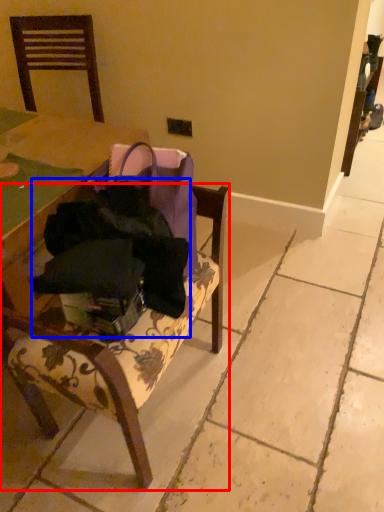
Question: Which object is further to the camera taking this photo, chair (highlighted by a red box) or clothing (highlighted by a blue box)?

Choices:
 (A) chair
 (B) clothing

Answer: (B)